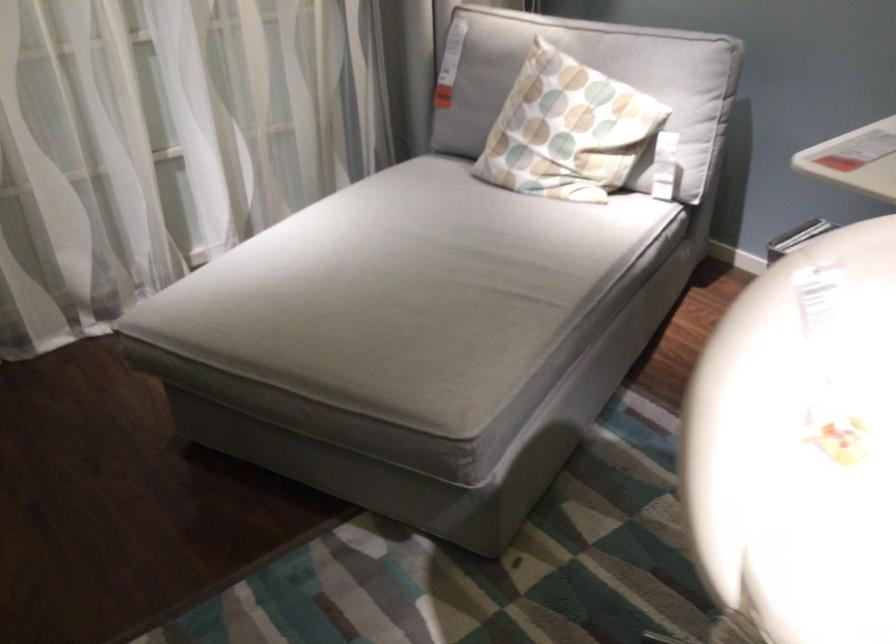
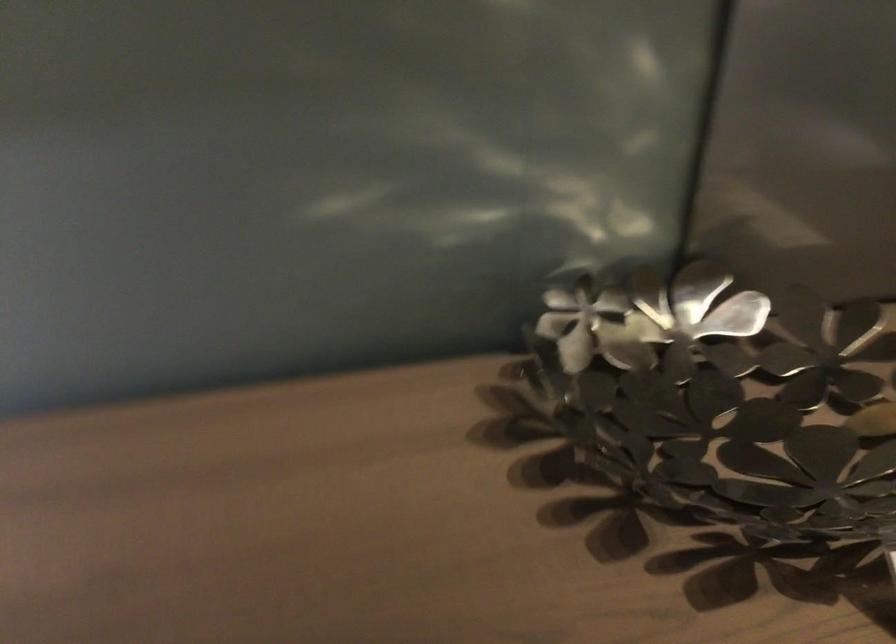
First-person continuous shooting, in which direction is the camera rotating?

The rotation direction of the camera is left-down.